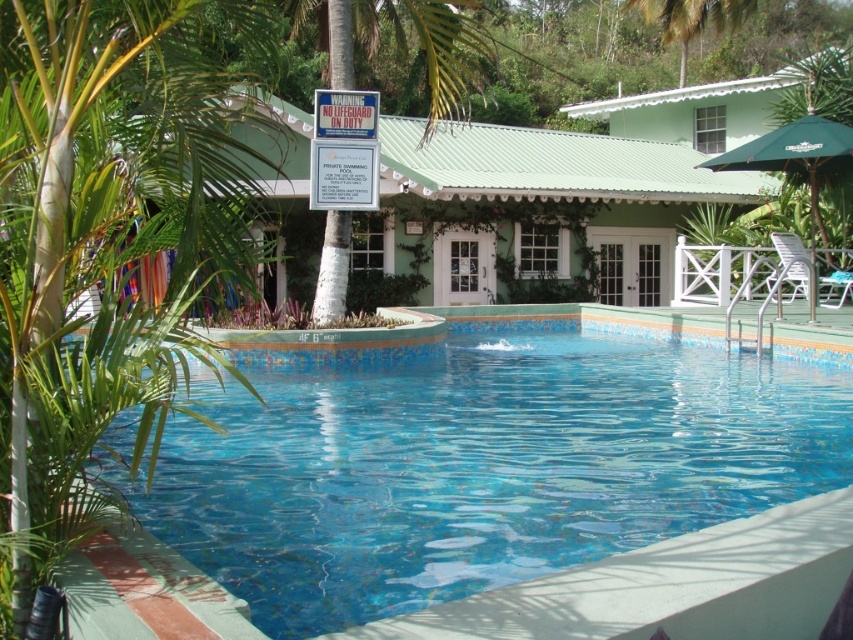
You are planning to place a decorative item in the swimming pool area. The blue mosaic tiles at center and the green fabric umbrella at upper right are both in view. Which object has a greater width?

The blue mosaic tiles at center has a greater width than the green fabric umbrella at upper right.

You are standing at the edge of the pool and notice two points marked in the scene. The first point is at coordinates point [675,216], and the second point is at point [819,116]. From your current position, which point is closer to you?

Point [819,116] is closer to you because it is in front of point [675,216], which is behind it.

You are standing at the edge of the pool and want to place a floating ring between the blue mosaic tiles at center and the green fabric umbrella at upper right. Which object should you use as a reference point to ensure the ring is closer to you?

You should use the blue mosaic tiles at center as the reference point because it is closer to the viewer than the green fabric umbrella at upper right, so placing the ring near it will keep it closer to you.